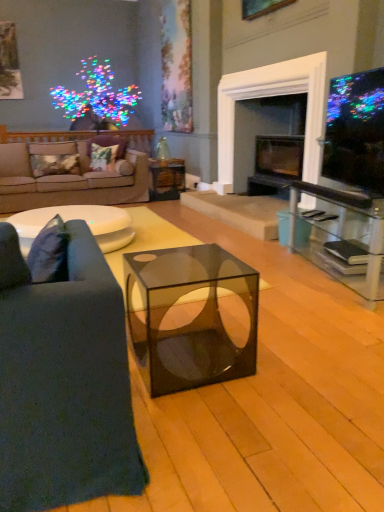
Locate an element on the screen. vacant region below transparent glass cube at center (from a real-world perspective) is located at coordinates (178, 354).